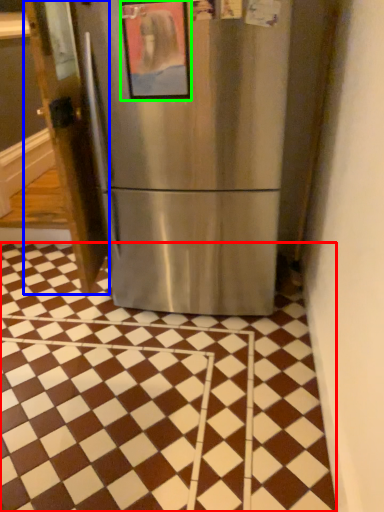
Question: Based on their relative distances, which object is nearer to tile (highlighted by a red box)? Choose from door (highlighted by a blue box) and picture frame (highlighted by a green box).

Choices:
 (A) door
 (B) picture frame

Answer: (A)